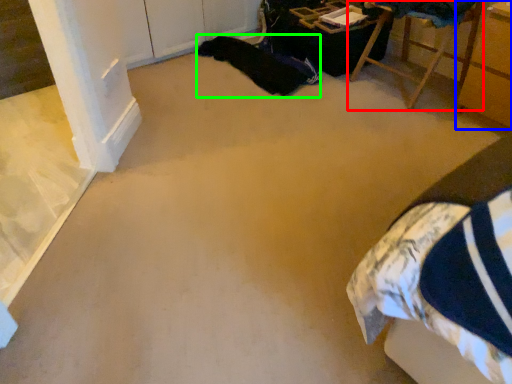
Question: Which object is positioned closest to furniture (highlighted by a red box)? Select from furniture (highlighted by a blue box) and blanket (highlighted by a green box).

Choices:
 (A) furniture
 (B) blanket

Answer: (A)